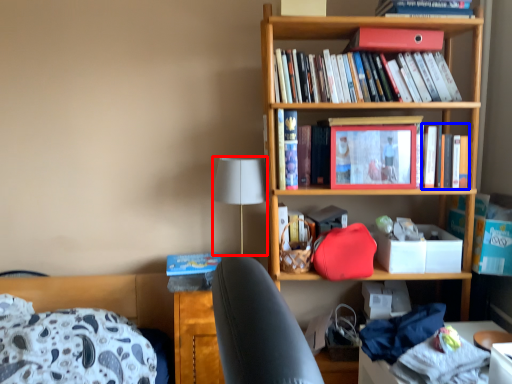
Question: Which object is further to the camera taking this photo, lamp (highlighted by a red box) or book (highlighted by a blue box)?

Choices:
 (A) lamp
 (B) book

Answer: (B)